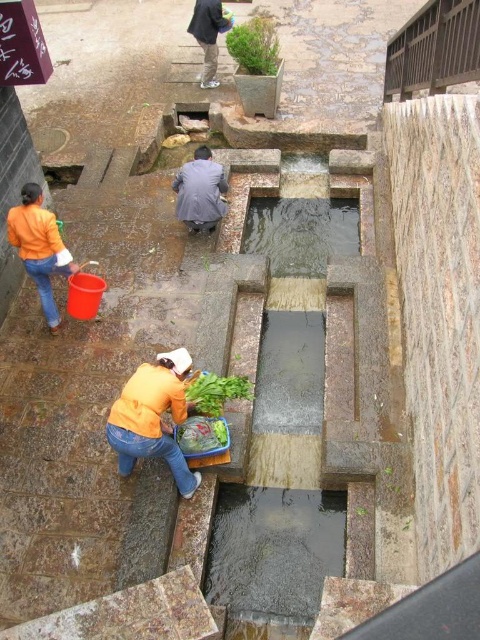
In the scene shown: Does orange matte shirt at lower center appear on the left side of green leafy vegetable at center?

Indeed, orange matte shirt at lower center is positioned on the left side of green leafy vegetable at center.

Does orange matte shirt at lower center have a greater width compared to green leafy vegetable at center?

Yes, orange matte shirt at lower center is wider than green leafy vegetable at center.

This screenshot has height=640, width=480. What do you see at coordinates (153, 417) in the screenshot?
I see `orange matte shirt at lower center` at bounding box center [153, 417].

This screenshot has width=480, height=640. Find the location of `orange matte shirt at lower center`. orange matte shirt at lower center is located at coordinates (153, 417).

Between dark gray suit at center and green leafy vegetable at center, which one appears on the right side from the viewer's perspective?

green leafy vegetable at center is more to the right.

Who is more distant from viewer, (x=200, y=168) or (x=226, y=388)?

Point (x=200, y=168)

Image resolution: width=480 pixels, height=640 pixels. I want to click on dark gray suit at center, so pos(200,192).

Is point (279, 202) behind point (235, 376)?

Yes, point (279, 202) is behind point (235, 376).

Locate an element on the screen. Image resolution: width=480 pixels, height=640 pixels. clear water at center is located at coordinates (300, 232).